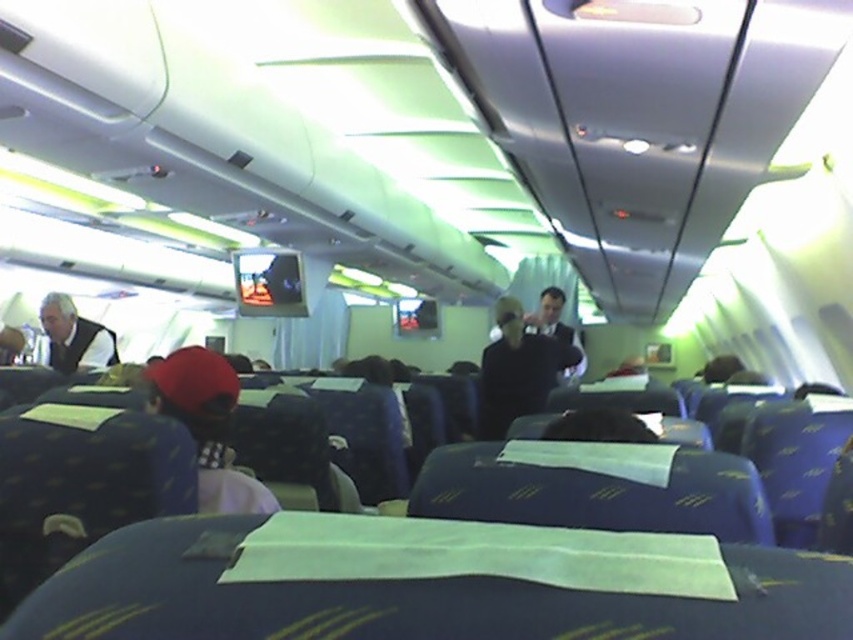
You are a flight attendant checking the overhead compartments. You notice two items in the aisle at center, a dark blue fabric jacket at center and a dark blue suit at center. Which item is closer to the floor?

The dark blue fabric jacket at center is located below the dark blue suit at center, so the dark blue fabric jacket at center is closer to the floor.

You are a flight attendant carrying a 10 feet long tray. You need to move through the airplane cabin and pass between the dark blue fabric jacket at center and the white shirt at left. Can your tray fit through the space between them?

The distance between the dark blue fabric jacket at center and the white shirt at left is 9.90 feet, which is slightly less than the 10 feet length of the tray. Therefore, the tray cannot fit through the space between them.

You are a flight attendant and you see a passenger wearing a white shirt at left and another wearing a red fabric cap at left. Which object is positioned more to the right side?

The red fabric cap at left is positioned to the right of the white shirt at left, so the red fabric cap at left is more to the right side.